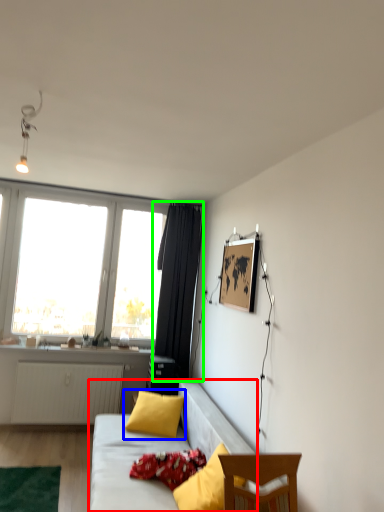
Question: Based on their relative distances, which object is nearer to studio couch (highlighted by a red box)? Choose from pillow (highlighted by a blue box) and curtain (highlighted by a green box).

Choices:
 (A) pillow
 (B) curtain

Answer: (A)